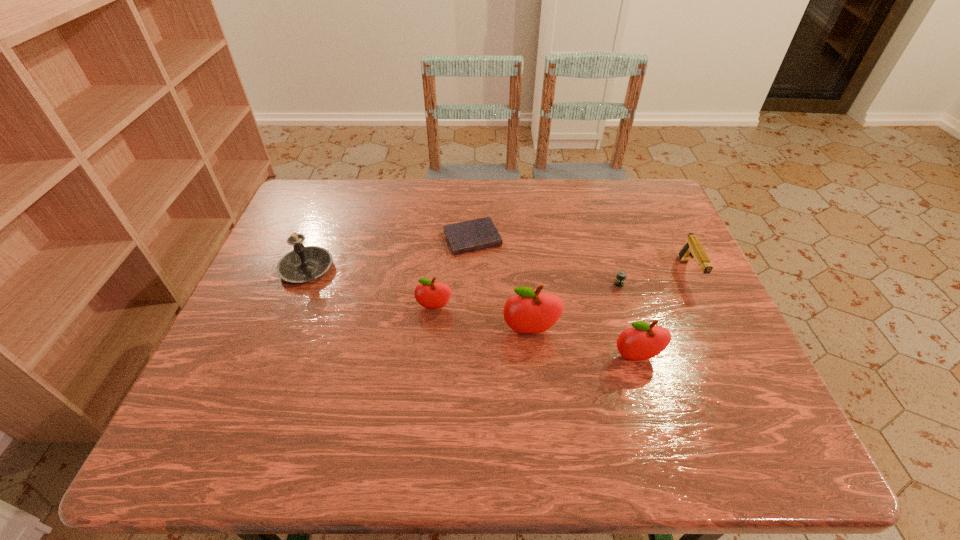
Locate an element on the screen. The width and height of the screenshot is (960, 540). vacant space that satisfies the following two spatial constraints: 1. on the front side of the farthest apple; 2. on the right side of the second apple from left to right is located at coordinates (432, 331).

Where is `blank space that satisfies the following two spatial constraints: 1. on the front side of the second shortest apple; 2. on the left side of the farthest apple`? blank space that satisfies the following two spatial constraints: 1. on the front side of the second shortest apple; 2. on the left side of the farthest apple is located at coordinates (429, 357).

Where is `vacant position in the image that satisfies the following two spatial constraints: 1. on the back side of the tallest apple; 2. on the left side of the second shortest object`? The width and height of the screenshot is (960, 540). vacant position in the image that satisfies the following two spatial constraints: 1. on the back side of the tallest apple; 2. on the left side of the second shortest object is located at coordinates (525, 284).

Locate an element on the screen. Image resolution: width=960 pixels, height=540 pixels. free spot that satisfies the following two spatial constraints: 1. on the front side of the nearest apple; 2. on the right side of the diary is located at coordinates (470, 357).